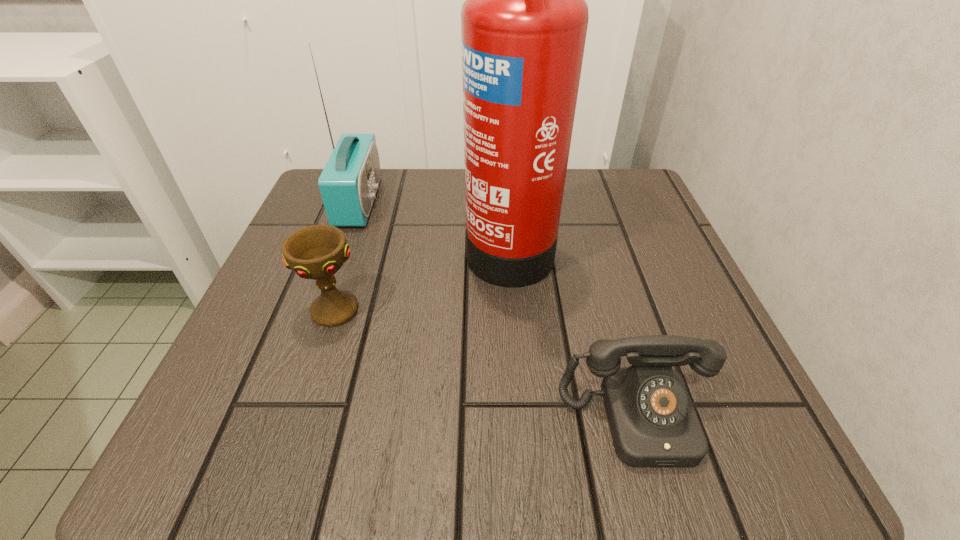
Locate an element on the screen. free space between the third shortest object and the fire extinguisher is located at coordinates (434, 223).

You are a GUI agent. You are given a task and a screenshot of the screen. Output one action in this format:
    pyautogui.click(x=<x>, y=<y>)
    Task: Click on the vacant point located between the radio receiver and the nearest object
    
    Given the screenshot: What is the action you would take?
    pyautogui.click(x=498, y=310)

Where is `vacant space in between the radio receiver and the telephone`? The image size is (960, 540). vacant space in between the radio receiver and the telephone is located at coordinates (498, 310).

At what (x,y) coordinates should I click in order to perform the action: click on object that ranks as the closest to the fire extinguisher. Please return your answer as a coordinate pair (x, y). The image size is (960, 540). Looking at the image, I should click on (653, 422).

Locate an element on the screen. The image size is (960, 540). the closest object to the chalice is located at coordinates (523, 25).

Where is `free region that satisfies the following two spatial constraints: 1. on the front panel of the second tallest object; 2. on the right side of the second shortest object`? free region that satisfies the following two spatial constraints: 1. on the front panel of the second tallest object; 2. on the right side of the second shortest object is located at coordinates (320, 310).

At what (x,y) coordinates should I click in order to perform the action: click on free spot that satisfies the following two spatial constraints: 1. on the front panel of the third tallest object; 2. on the right side of the third shortest object. Please return your answer as a coordinate pair (x, y). The height and width of the screenshot is (540, 960). Looking at the image, I should click on (320, 310).

I want to click on free space that satisfies the following two spatial constraints: 1. on the back side of the chalice; 2. on the front panel of the radio receiver, so click(x=371, y=202).